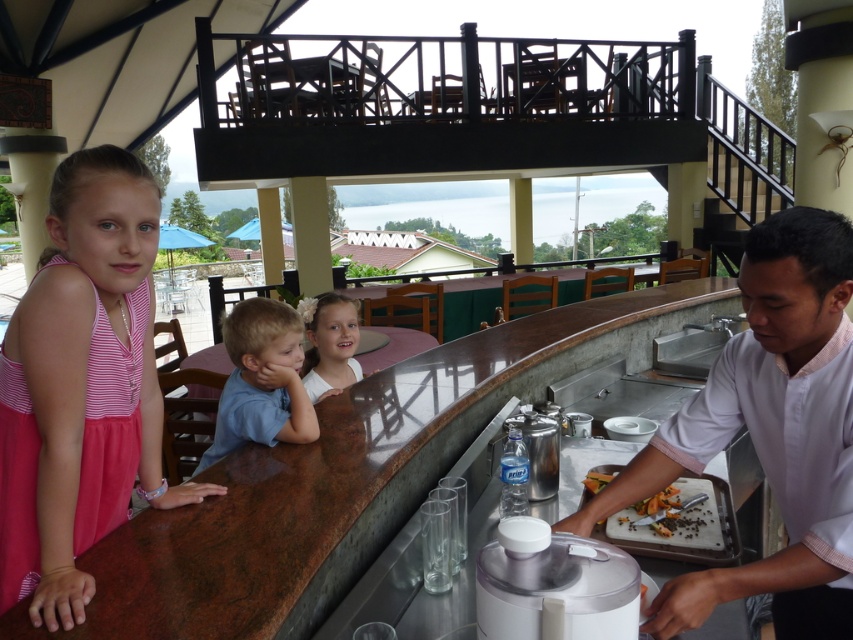
You are a server at the bar and need to place a 7.5 inch long drink order slip between the marble countertop at center and the dark brown wooden tray at lower right. Will there be enough space to fit the slip horizontally between them?

The marble countertop at center and dark brown wooden tray at lower right are 7.35 inches apart from each other. Since the drink order slip is 7.5 inches long, it will not fit horizontally between them as the distance is slightly less than the slip length.

You are a bartender preparing drinks for a party. You have a bottle of alcohol that is 15 cm in diameter. You need to place it on either the marble countertop at center or the dark brown wooden tray at lower right. Based on their sizes, which surface can definitely accommodate the bottle?

The marble countertop at center is wider than the dark brown wooden tray at lower right, so the bottle of alcohol with 15 cm diameter can definitely be placed on the marble countertop at center.